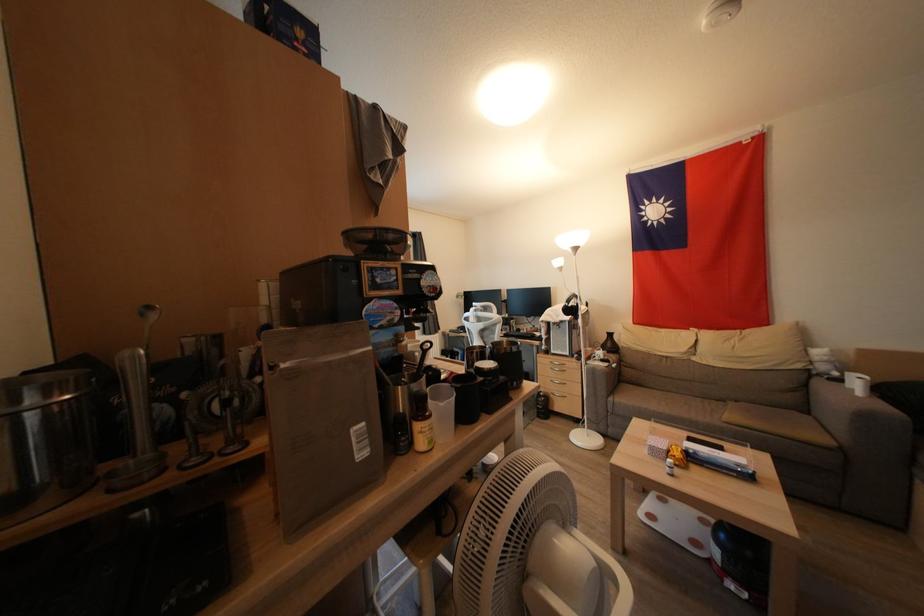
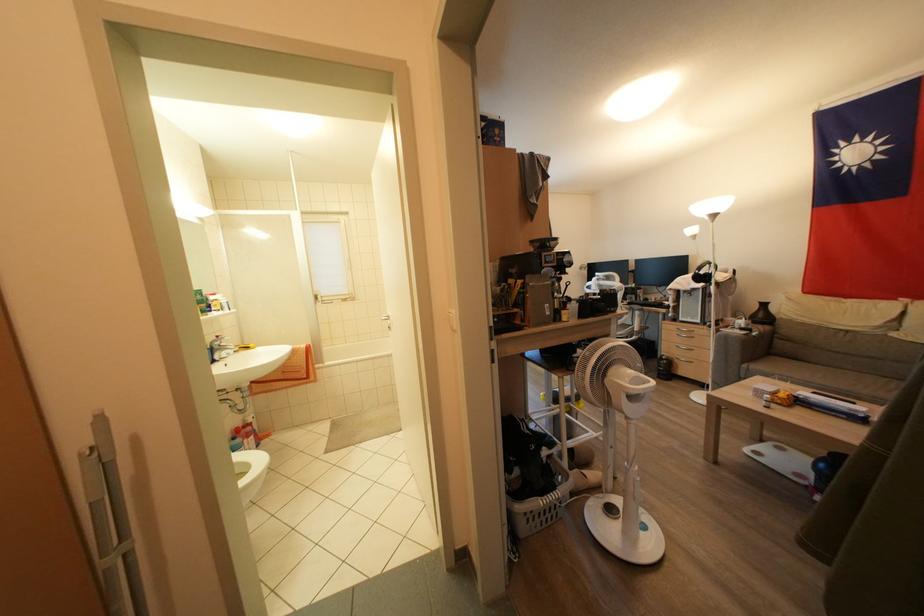
The point at (608, 365) is marked in the first image. Where is the corresponding point in the second image?

(747, 333)